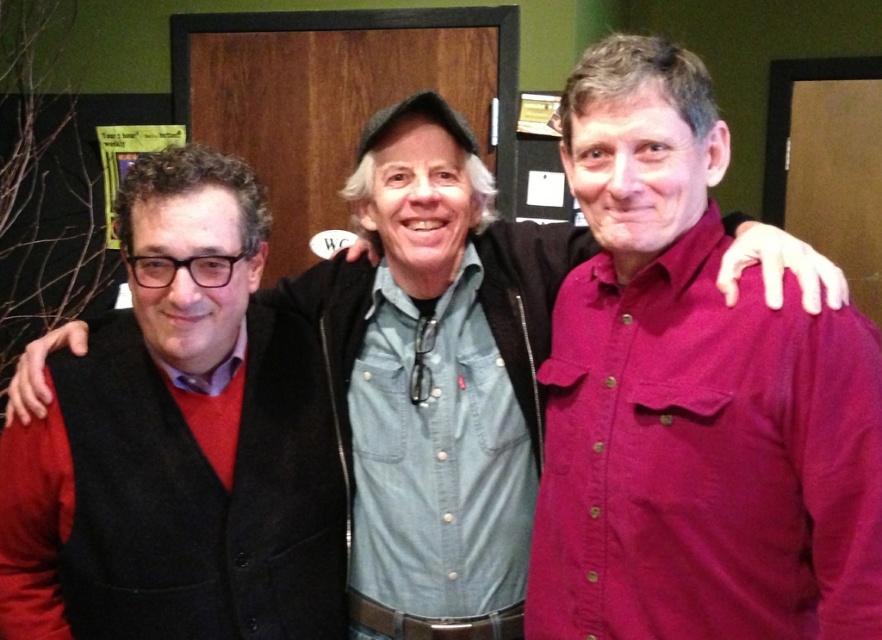
Consider the image. You are taking a photo of the three people in the scene. You want to focus on the person closest to the camera. Which of the two points, point (865, 372) or point (275, 616), should you adjust your camera focus to prioritize?

Point (865, 372) is closer to the camera than point (275, 616), so you should focus on point (865, 372) to prioritize the person closest to the camera.

You are standing in the room where the three people are. You need to locate the matte burgundy shirt at center. Based on the coordinates provided, can you tell me in which general direction from your current position you should look to find it?

The matte burgundy shirt at center is located at coordinates point (692,397). Since these coordinates are in the lower right quadrant of the image, you should look towards the lower right direction from your current position to find it.

Based on the scene description, which object is layered on top of the other between the matte burgundy shirt at center and the matte black vest at left?

The matte burgundy shirt at center is positioned over the matte black vest at left, so the matte burgundy shirt at center is on top.